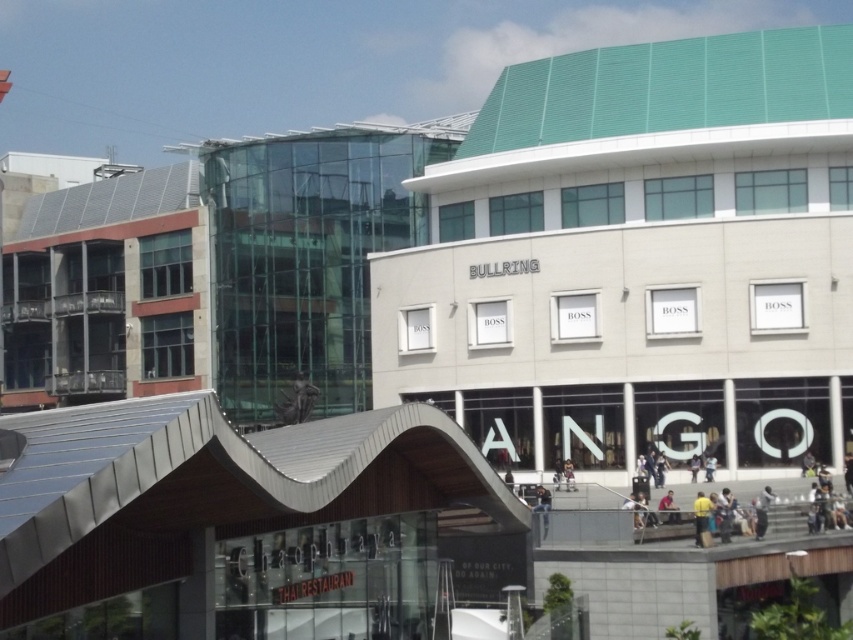
Between light gray fabric jacket at lower right and light brown leather jacket at lower center, which one has less height?

Standing shorter between the two is light brown leather jacket at lower center.

Is light gray fabric jacket at lower right closer to camera compared to light brown leather jacket at lower center?

Yes.

Between point (759, 531) and point (666, 497), which one is positioned in front?

Point (759, 531) is in front.

You are a GUI agent. You are given a task and a screenshot of the screen. Output one action in this format:
    pyautogui.click(x=<x>, y=<y>)
    Task: Click on the light gray fabric jacket at lower right
    
    Given the screenshot: What is the action you would take?
    pyautogui.click(x=762, y=509)

Which is behind, point (810, 468) or point (573, 483)?

Positioned behind is point (573, 483).

Does dark gray fabric jacket at lower right appear on the left side of light brown leather jacket at center?

Incorrect, dark gray fabric jacket at lower right is not on the left side of light brown leather jacket at center.

Where is `dark gray fabric jacket at lower right`? The height and width of the screenshot is (640, 853). dark gray fabric jacket at lower right is located at coordinates (808, 465).

Is light brown leather jacket at lower center thinner than dark gray fabric jacket at lower right?

No.

Does light brown leather jacket at lower center lie in front of dark gray fabric jacket at lower right?

Yes, it is in front of dark gray fabric jacket at lower right.

Which is behind, point (671, 502) or point (804, 461)?

The point (804, 461) is more distant.

Where is `light brown leather jacket at lower center`? light brown leather jacket at lower center is located at coordinates (668, 508).